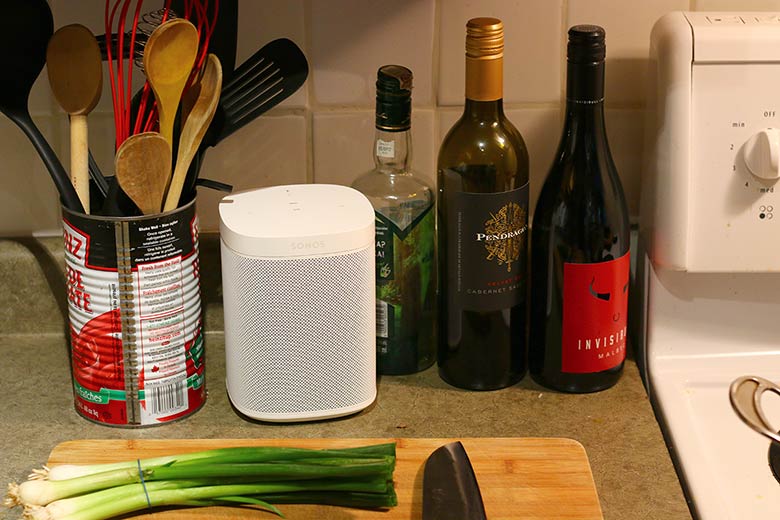
Where is `knob`? The image size is (780, 520). knob is located at coordinates (763, 157).